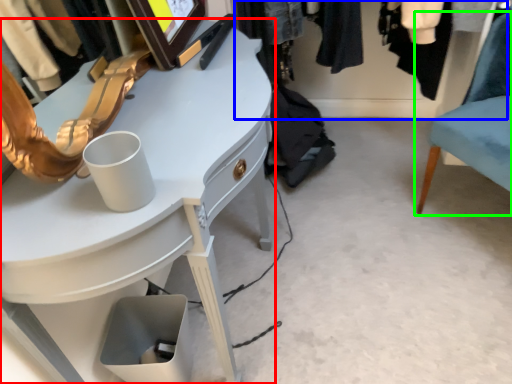
Question: Considering the real-world distances, which object is closest to desk (highlighted by a red box)? closet (highlighted by a blue box) or chair (highlighted by a green box).

Choices:
 (A) closet
 (B) chair

Answer: (B)